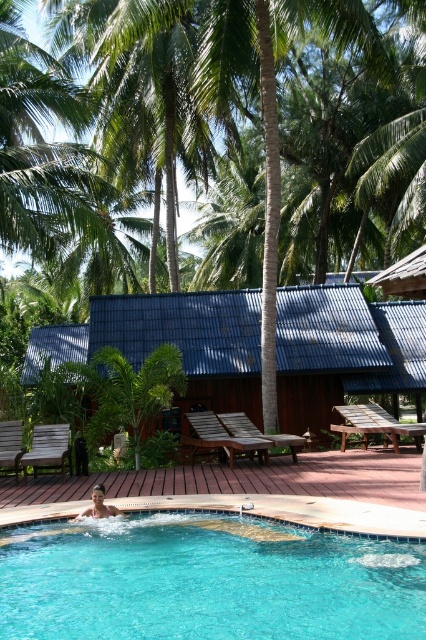
You are standing on the wooden deck and want to walk to the blue glassy swimming pool at lower left. Which direction should you head from the wooden hut at center?

You should head to the right from the wooden hut at center to reach the blue glassy swimming pool at lower left because the blue glassy swimming pool at lower left is located to the right of the wooden hut at center.

You are standing at the edge of the pool and want to place a small potted plant between the two points marked as point (244, 620) and point (333, 401). Which point should the plant be closer to if you want it to be nearer to the pool edge?

The plant should be placed closer to point (244, 620) because it is closer to the viewer, who is at the pool edge, compared to point (333, 401) which is further away.